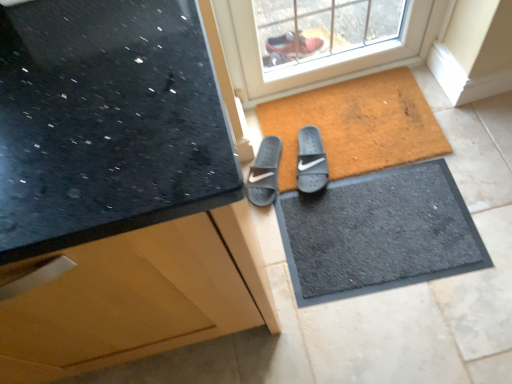
Question: Is black rubber doormat at center looking in the opposite direction of brown textured mat at center?

Choices:
 (A) yes
 (B) no

Answer: (A)

Question: Does black rubber doormat at center appear on the right side of brown textured mat at center?

Choices:
 (A) yes
 (B) no

Answer: (A)

Question: Can you confirm if black rubber doormat at center is taller than brown textured mat at center?

Choices:
 (A) yes
 (B) no

Answer: (B)

Question: From the image's perspective, is black rubber doormat at center on brown textured mat at center?

Choices:
 (A) no
 (B) yes

Answer: (A)

Question: Is black rubber doormat at center closer to camera compared to brown textured mat at center?

Choices:
 (A) no
 (B) yes

Answer: (B)

Question: Is gray rubber slide at center, the 1th footwear in the right-to-left sequence, taller or shorter than matte black countertop at upper left?

Choices:
 (A) short
 (B) tall

Answer: (A)

Question: Is gray rubber slide at center, which ranks as the 2th footwear in left-to-right order, inside or outside of matte black countertop at upper left?

Choices:
 (A) outside
 (B) inside

Answer: (A)

Question: Would you say gray rubber slide at center, the 1th footwear in the right-to-left sequence, is to the left or to the right of matte black countertop at upper left in the picture?

Choices:
 (A) right
 (B) left

Answer: (A)

Question: In terms of width, does gray rubber slide at center, the 1th footwear in the right-to-left sequence, look wider or thinner when compared to matte black countertop at upper left?

Choices:
 (A) thin
 (B) wide

Answer: (A)

Question: Considering the positions of gray rubber slide at center, which ranks as the 2th footwear in left-to-right order, and black rubber doormat at center in the image, is gray rubber slide at center, which ranks as the 2th footwear in left-to-right order, taller or shorter than black rubber doormat at center?

Choices:
 (A) short
 (B) tall

Answer: (B)

Question: From the image's perspective, relative to black rubber doormat at center, is gray rubber slide at center, the 1th footwear in the right-to-left sequence, above or below?

Choices:
 (A) below
 (B) above

Answer: (B)

Question: Is gray rubber slide at center, which ranks as the 2th footwear in left-to-right order, to the left or to the right of black rubber doormat at center in the image?

Choices:
 (A) left
 (B) right

Answer: (A)

Question: In terms of width, does gray rubber slide at center, the 1th footwear in the right-to-left sequence, look wider or thinner when compared to black rubber doormat at center?

Choices:
 (A) thin
 (B) wide

Answer: (A)

Question: Looking at their shapes, would you say brown textured mat at center is wider or thinner than matte black countertop at upper left?

Choices:
 (A) wide
 (B) thin

Answer: (B)

Question: From a real-world perspective, is brown textured mat at center above or below matte black countertop at upper left?

Choices:
 (A) above
 (B) below

Answer: (B)